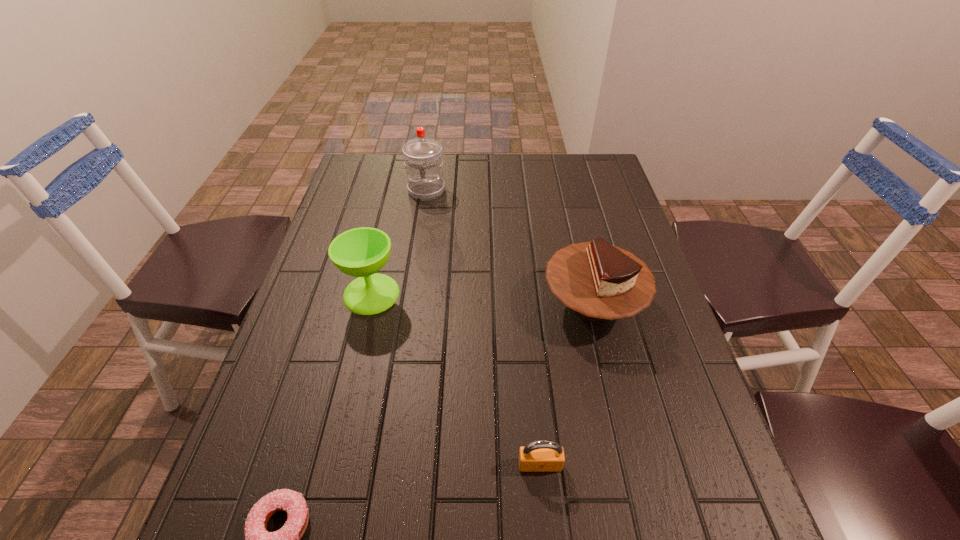
The height and width of the screenshot is (540, 960). In order to click on the farthest object in this screenshot , I will do `click(423, 162)`.

Locate an element on the screen. the tallest object is located at coordinates (423, 162).

Identify the location of the rightmost object. (599, 281).

At what (x,y) coordinates should I click in order to perform the action: click on wineglass. Please return your answer as a coordinate pair (x, y). Image resolution: width=960 pixels, height=540 pixels. Looking at the image, I should click on (360, 252).

This screenshot has width=960, height=540. Find the location of `the fourth object from left to right`. the fourth object from left to right is located at coordinates (542, 455).

In order to click on padlock in this screenshot , I will do `click(542, 455)`.

Where is `free space located 0.050m on the handle side of the tallest object`? This screenshot has height=540, width=960. free space located 0.050m on the handle side of the tallest object is located at coordinates (423, 210).

What are the coordinates of `vacant space located on the front of the rightmost object` in the screenshot? It's located at (609, 370).

The width and height of the screenshot is (960, 540). I want to click on vacant region located on the front of the wineglass, so click(325, 488).

You are a GUI agent. You are given a task and a screenshot of the screen. Output one action in this format:
    pyautogui.click(x=<x>, y=<y>)
    Task: Click on the vacant space situated 0.090m to unlock the second object from right to left from the front
    This screenshot has height=540, width=960.
    Given the screenshot: What is the action you would take?
    pyautogui.click(x=545, y=527)